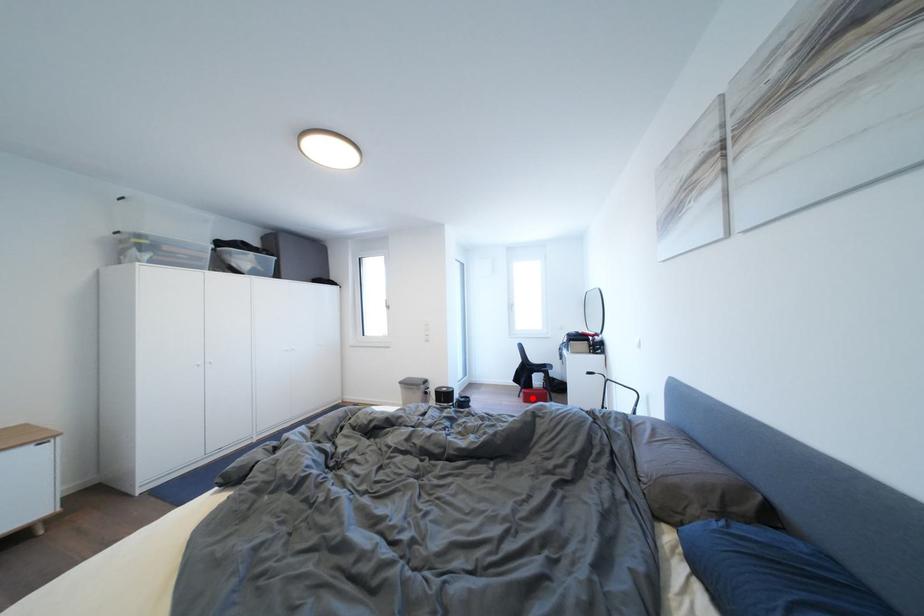
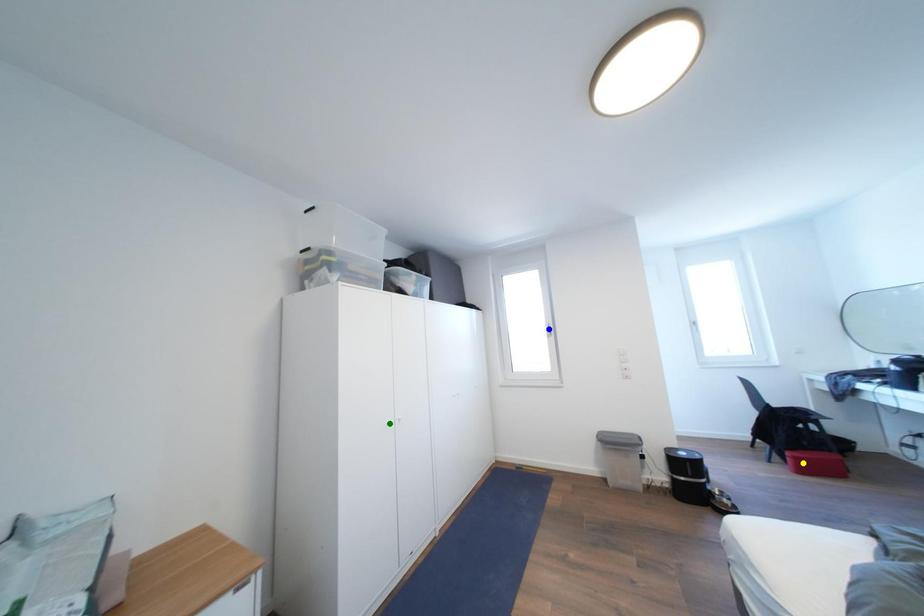
Question: I am providing you with two images of the same scene from different viewpoints. A red point is marked on the first image. You are given multiple points on the second image. Which mark in image 2 goes with the point in image 1?

Choices:
 (A) blue point
 (B) green point
 (C) yellow point

Answer: (C)